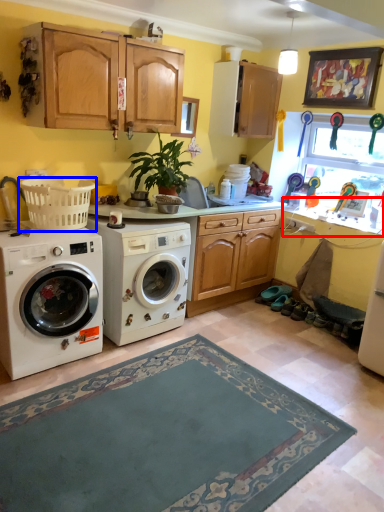
Question: Which object is further to the camera taking this photo, counter top (highlighted by a red box) or basket (highlighted by a blue box)?

Choices:
 (A) counter top
 (B) basket

Answer: (A)